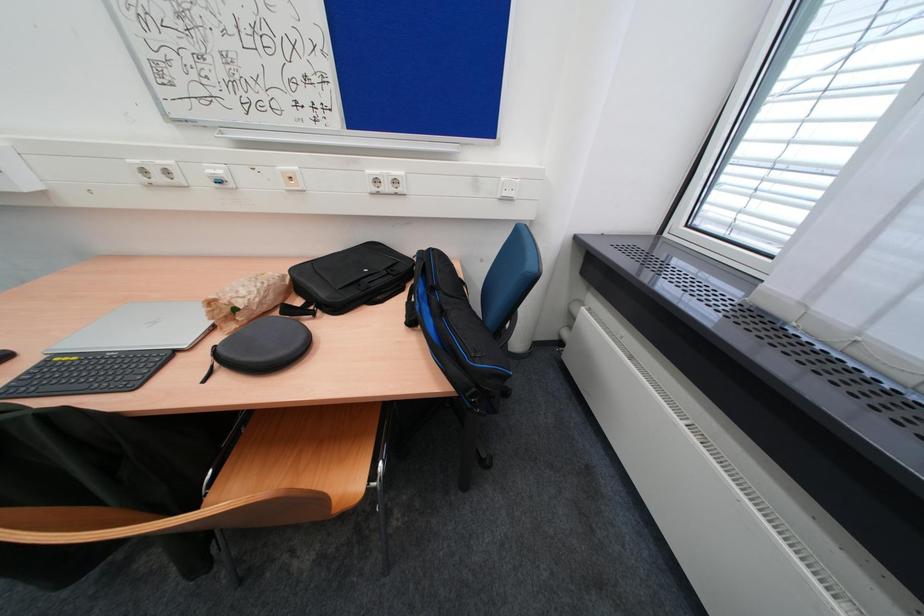
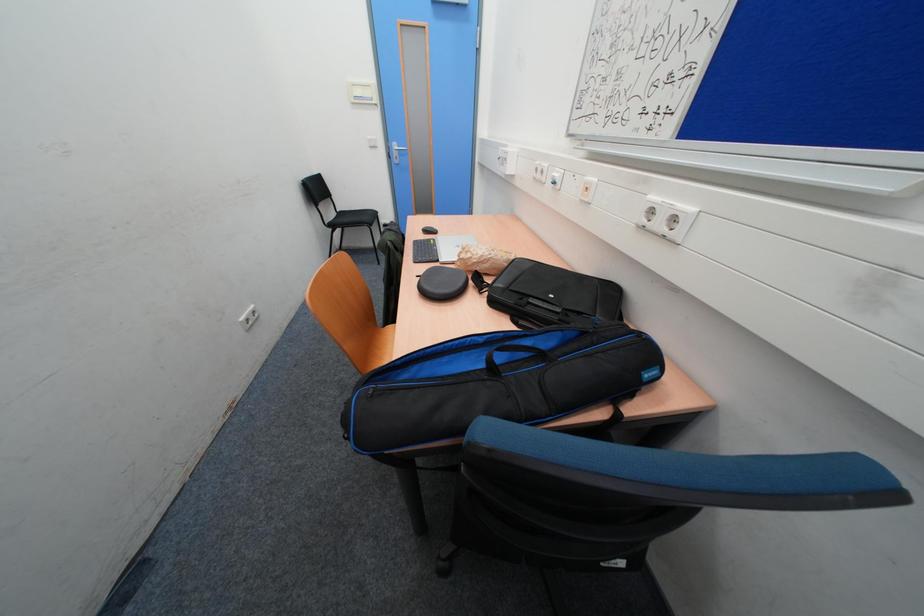
The images are taken continuously from a first-person perspective. In which direction is your viewpoint rotating?

The camera rotated toward left-down.